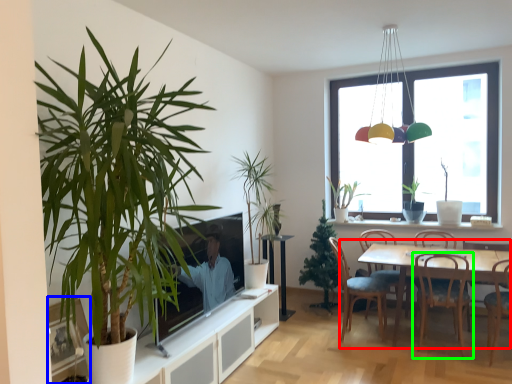
Question: Estimate the real-world distances between objects in this image. Which object is closer to kitchen & dining room table (highlighted by a red box), picture frame (highlighted by a blue box) or chair (highlighted by a green box)?

Choices:
 (A) picture frame
 (B) chair

Answer: (B)